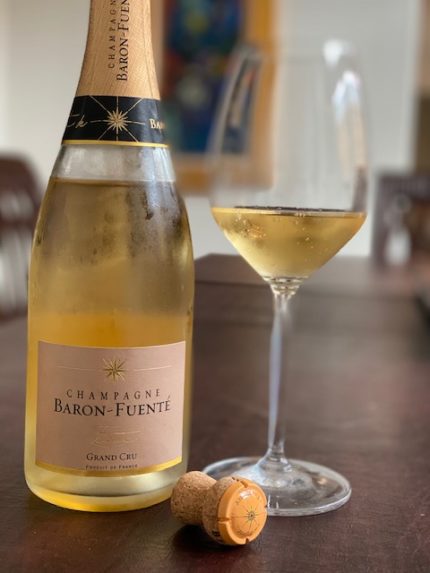
The image size is (430, 573). What are the coordinates of `chair in background behind champagne bottle` in the screenshot? It's located at (1, 227).